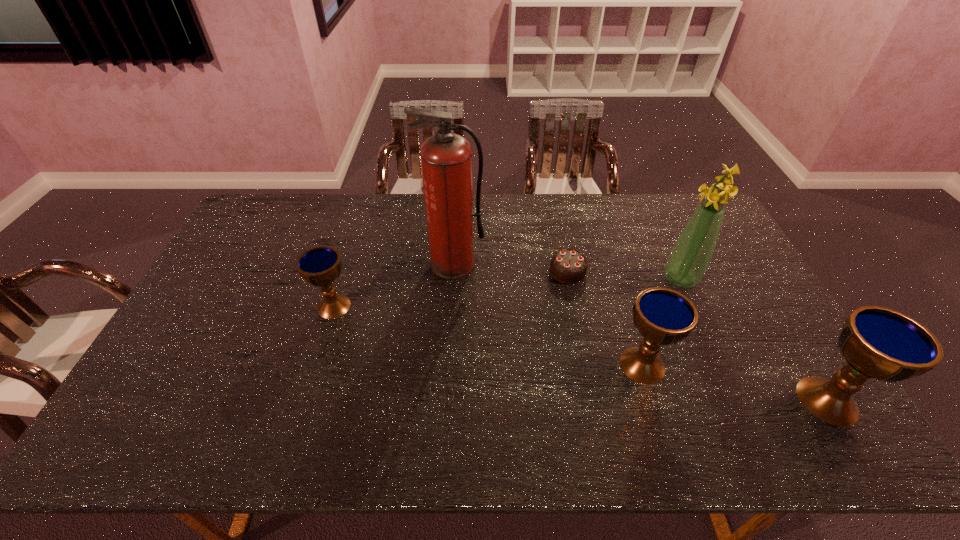
Image resolution: width=960 pixels, height=540 pixels. In order to click on vacant space that's between the fifth shortest object and the rightmost object in this screenshot , I will do `click(754, 340)`.

At what (x,y) coordinates should I click in order to perform the action: click on vacant space that is in between the bouquet and the fourth object from right to left. Please return your answer as a coordinate pair (x, y). Looking at the image, I should click on (x=624, y=275).

Identify which object is the fourth closest to the third shortest object. Please provide its 2D coordinates. Your answer should be formatted as a tuple, i.e. [(x, y)], where the tuple contains the x and y coordinates of a point satisfying the conditions above.

[(446, 158)]

Locate an element on the screen. The height and width of the screenshot is (540, 960). object that is the fourth nearest to the fourth tallest object is located at coordinates (446, 158).

Identify which chalice is located as the nearest to the bouquet. Please provide its 2D coordinates. Your answer should be formatted as a tuple, i.e. [(x, y)], where the tuple contains the x and y coordinates of a point satisfying the conditions above.

[(663, 316)]

Image resolution: width=960 pixels, height=540 pixels. I want to click on chalice object that ranks as the third closest to the bouquet, so 320,266.

Locate an element on the screen. The width and height of the screenshot is (960, 540). free point that satisfies the following two spatial constraints: 1. on the front-facing side of the rightmost chalice; 2. on the left side of the second object from right to left is located at coordinates (736, 400).

You are a GUI agent. You are given a task and a screenshot of the screen. Output one action in this format:
    pyautogui.click(x=<x>, y=<y>)
    Task: Click on the vacant space that satisfies the following two spatial constraints: 1. at the nozzle of the rightmost chalice; 2. on the right side of the tallest object
    The height and width of the screenshot is (540, 960).
    Given the screenshot: What is the action you would take?
    [x=445, y=400]

I want to click on free location that satisfies the following two spatial constraints: 1. at the nozzle of the tallest object; 2. on the right side of the chocolate cake, so click(x=453, y=271).

Locate an element on the screen. Image resolution: width=960 pixels, height=540 pixels. blank area in the image that satisfies the following two spatial constraints: 1. on the front side of the second tallest chalice; 2. on the right side of the rightmost chalice is located at coordinates (653, 400).